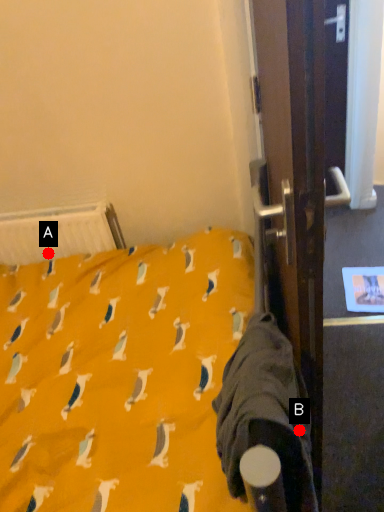
Question: Two points are circled on the image, labeled by A and B beside each circle. Which point is closer to the camera taking this photo?

Choices:
 (A) A is closer
 (B) B is closer

Answer: (B)